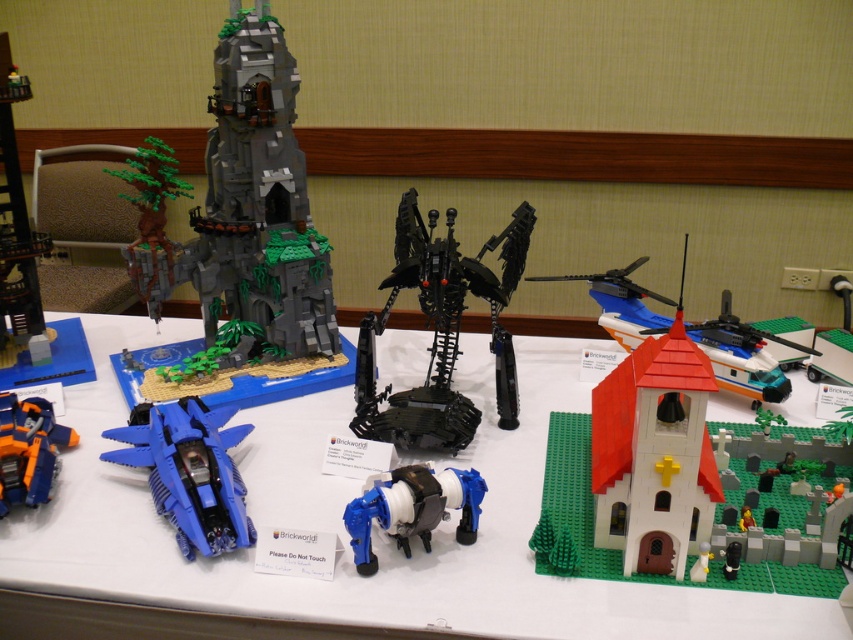
You are a LEGO enthusiast standing at the front of the table where the models are displayed. You notice two points marked on the table at coordinates point (259, 147) and point (25, 496). Which point is closer to you?

Point (25, 496) is closer to you because it is in front of point (259, 147), which is behind it.

You are a curator at the LEGO exhibition and need to place a new display label for the black metallic robot at center. According to the coordinates provided, where should the label be positioned relative to the robot?

The label should be placed directly below the black metallic robot at center, as its coordinates are at point (440,332), which indicates its central position on the table.

You are an event organizer at the LEGO exhibition and need to determine if the dark gray stone tower at upper left can be placed on a shelf that can only hold items smaller than the orange and blue plastic transformer robot at lower left. Can it fit?

The dark gray stone tower at upper left is larger in size than the orange and blue plastic transformer robot at lower left, so it cannot fit on the shelf designed for items smaller than the robot.